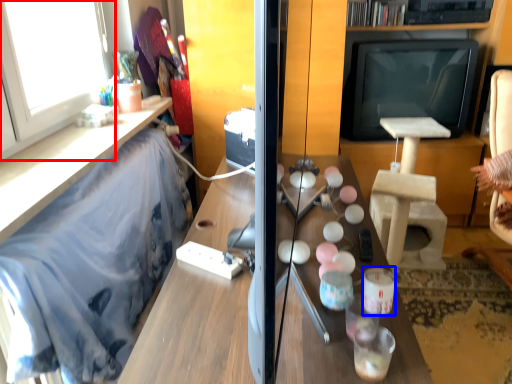
Question: Which object is further to the camera taking this photo, window (highlighted by a red box) or candle holder (highlighted by a blue box)?

Choices:
 (A) window
 (B) candle holder

Answer: (A)